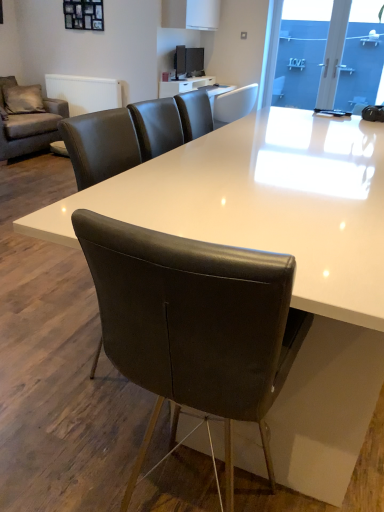
Question: From a real-world perspective, is white leather chair at upper center, the first chair when ordered from top to bottom, positioned over blue glass door at upper right based on gravity?

Choices:
 (A) yes
 (B) no

Answer: (B)

Question: Is white leather chair at upper center, the first chair viewed from the back, closer to the viewer compared to blue glass door at upper right?

Choices:
 (A) no
 (B) yes

Answer: (A)

Question: From the image's perspective, is white leather chair at upper center, which ranks as the 2th chair in bottom-to-top order, beneath blue glass door at upper right?

Choices:
 (A) yes
 (B) no

Answer: (A)

Question: Does white leather chair at upper center, which ranks as the 2th chair in bottom-to-top order, lie behind blue glass door at upper right?

Choices:
 (A) no
 (B) yes

Answer: (B)

Question: Is white leather chair at upper center, acting as the second chair starting from the front, smaller than blue glass door at upper right?

Choices:
 (A) yes
 (B) no

Answer: (B)

Question: In terms of size, does blue glass door at upper right appear bigger or smaller than transparent glass door at upper right?

Choices:
 (A) big
 (B) small

Answer: (A)

Question: Considering the relative positions of blue glass door at upper right and transparent glass door at upper right in the image provided, is blue glass door at upper right to the left or to the right of transparent glass door at upper right?

Choices:
 (A) right
 (B) left

Answer: (B)

Question: Considering the positions of blue glass door at upper right and transparent glass door at upper right in the image, is blue glass door at upper right taller or shorter than transparent glass door at upper right?

Choices:
 (A) tall
 (B) short

Answer: (A)

Question: Is point (289, 57) positioned closer to the camera than point (369, 30)?

Choices:
 (A) farther
 (B) closer

Answer: (A)

Question: In terms of size, does transparent glass door at upper right appear bigger or smaller than white leather chair at upper center, the first chair viewed from the back?

Choices:
 (A) small
 (B) big

Answer: (A)

Question: Choose the correct answer: Is transparent glass door at upper right inside white leather chair at upper center, the first chair when ordered from top to bottom, or outside it?

Choices:
 (A) inside
 (B) outside

Answer: (B)

Question: Visually, is transparent glass door at upper right positioned to the left or to the right of white leather chair at upper center, which ranks as the 2th chair in bottom-to-top order?

Choices:
 (A) left
 (B) right

Answer: (B)

Question: From the image's perspective, relative to white leather chair at upper center, acting as the second chair starting from the front, is transparent glass door at upper right above or below?

Choices:
 (A) above
 (B) below

Answer: (A)

Question: Would you say blue glass door at upper right is inside or outside white leather chair at upper center, the first chair when ordered from top to bottom?

Choices:
 (A) inside
 (B) outside

Answer: (B)

Question: Is point (359, 62) closer or farther from the camera than point (230, 99)?

Choices:
 (A) closer
 (B) farther

Answer: (B)